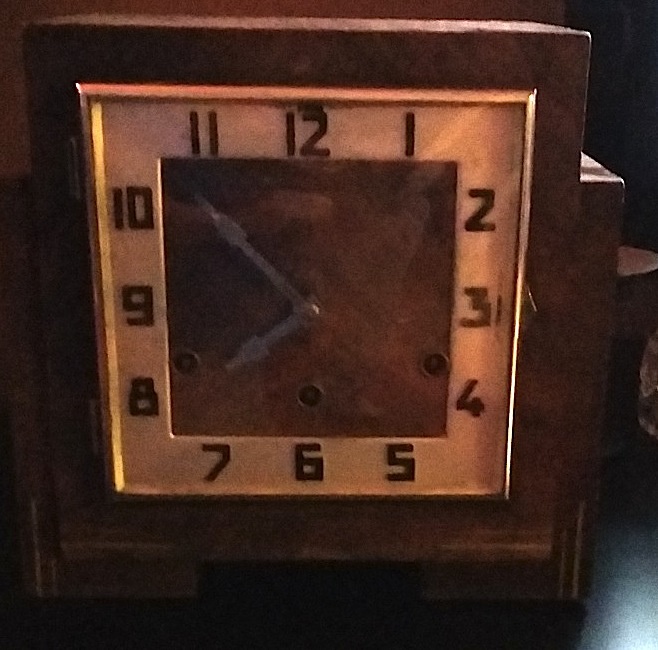
The width and height of the screenshot is (658, 650). Identify the location of clock face glass. (445, 175), (195, 390).